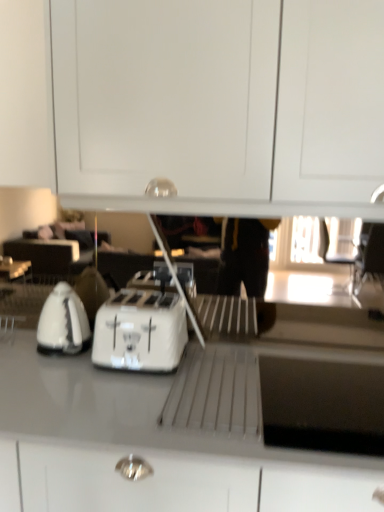
At what (x,y) coordinates should I click in order to perform the action: click on empty space that is ontop of white glossy countertop at center (from a real-world perspective). Please return your answer as a coordinate pair (x, y). The height and width of the screenshot is (512, 384). Looking at the image, I should click on (216, 393).